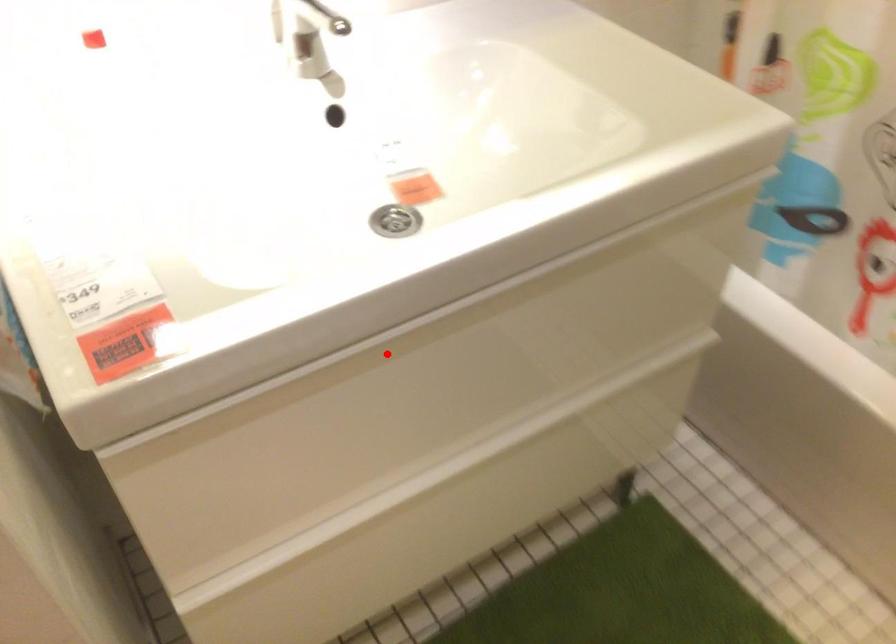
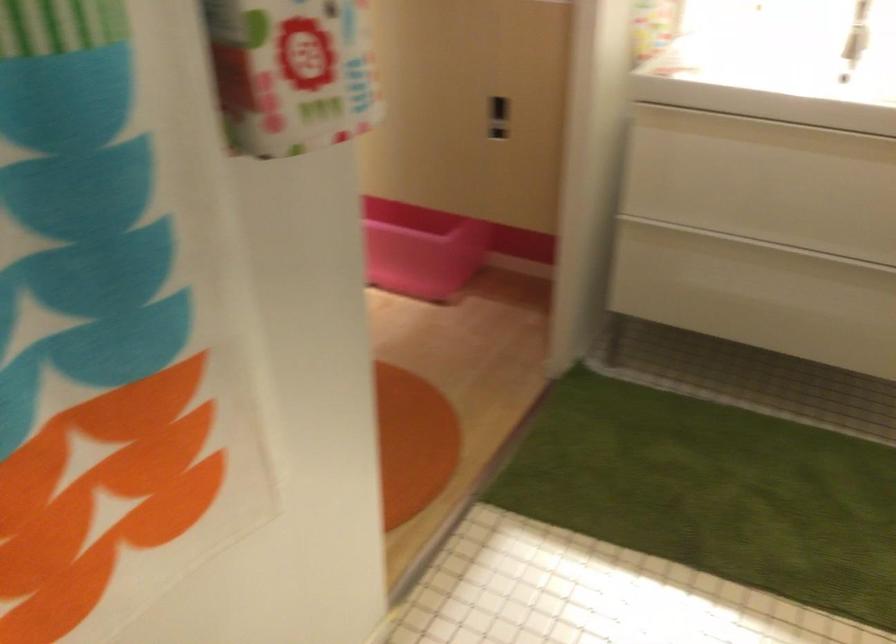
Question: I am providing you with two images of the same scene from different viewpoints. Image1 has a red point marked. In image2, the corresponding 3D location appears at what relative position? Reply with the corresponding letter.

Choices:
 (A) Closer
 (B) Farther

Answer: (B)